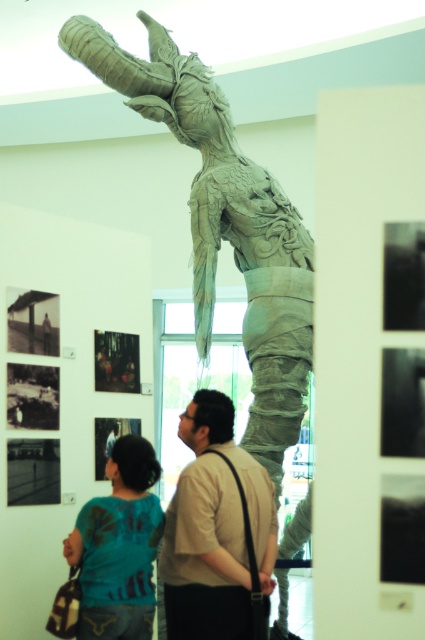
Question: Considering the relative positions of light brown leather shirt at center and teal fabric shirt at lower left in the image provided, where is light brown leather shirt at center located with respect to teal fabric shirt at lower left?

Choices:
 (A) above
 (B) below

Answer: (A)

Question: Which object is positioned closest to the light brown leather shirt at center?

Choices:
 (A) carved wood dragon at center
 (B) teal fabric shirt at lower left

Answer: (B)

Question: Which point is closer to the camera taking this photo?

Choices:
 (A) (260, 520)
 (B) (104, 624)
 (C) (195, 344)

Answer: (B)

Question: Which of the following is the farthest from the observer?

Choices:
 (A) (108, 563)
 (B) (184, 582)

Answer: (A)

Question: Is carved wood dragon at center thinner than light brown leather shirt at center?

Choices:
 (A) yes
 (B) no

Answer: (B)

Question: Can you confirm if light brown leather shirt at center is wider than teal fabric shirt at lower left?

Choices:
 (A) no
 (B) yes

Answer: (B)